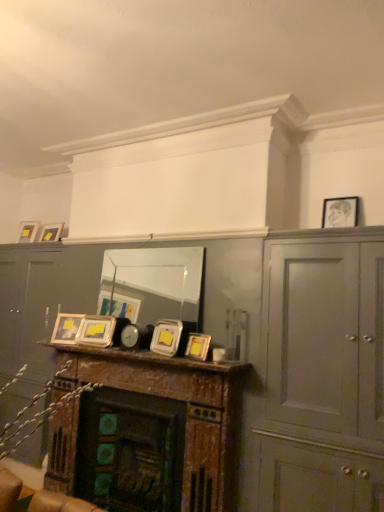
Locate an element on the screen. The image size is (384, 512). blank space situated above clear glass mirror at center (from a real-world perspective) is located at coordinates (161, 245).